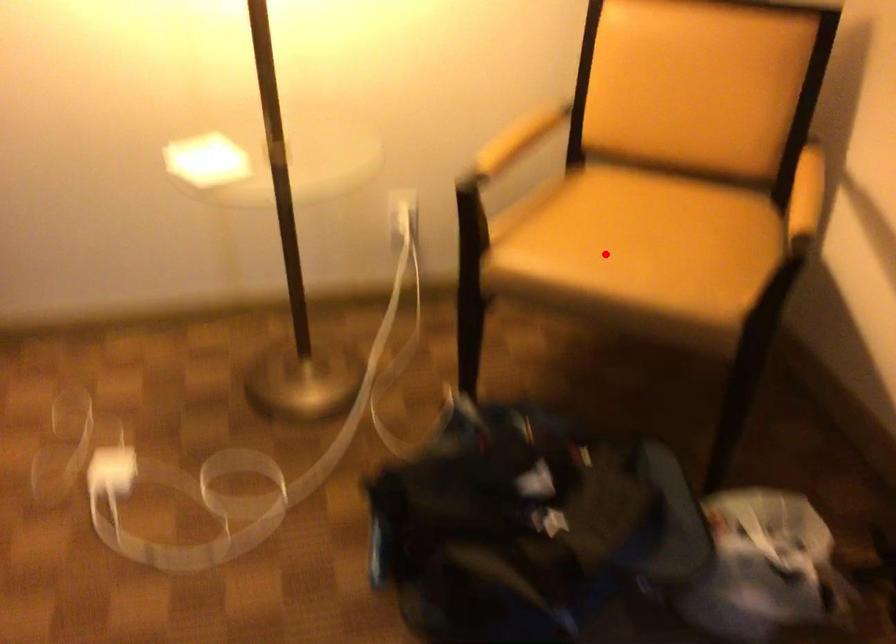
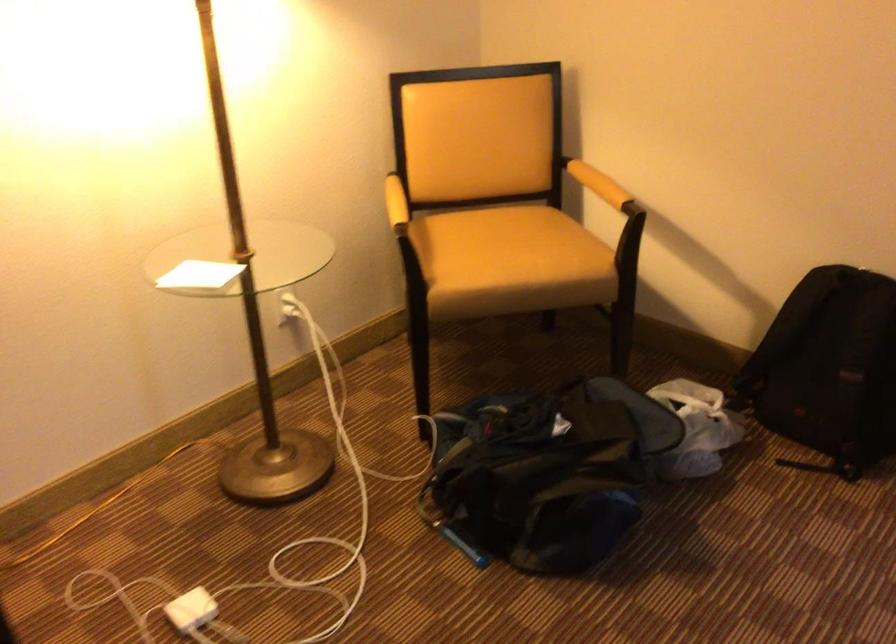
Question: I am providing you with two images of the same scene from different viewpoints. A red point is marked on the first image. Is the red point's position out of view in image 2?

Choices:
 (A) Yes
 (B) No

Answer: (B)